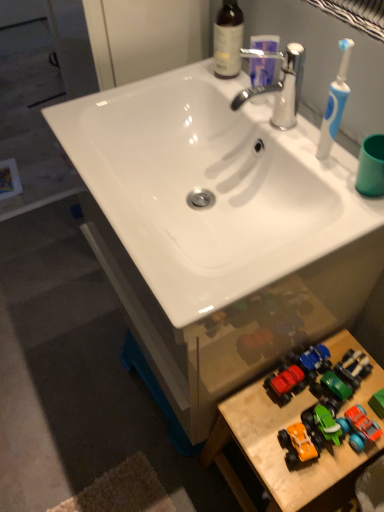
Question: Can you confirm if orange matte toy car at lower right is shorter than white glossy sink at center?

Choices:
 (A) yes
 (B) no

Answer: (A)

Question: Is orange matte toy car at lower right further to the viewer compared to white glossy sink at center?

Choices:
 (A) no
 (B) yes

Answer: (B)

Question: Considering the relative sizes of orange matte toy car at lower right and white glossy sink at center in the image provided, is orange matte toy car at lower right smaller than white glossy sink at center?

Choices:
 (A) no
 (B) yes

Answer: (B)

Question: Is orange matte toy car at lower right bigger than white glossy sink at center?

Choices:
 (A) yes
 (B) no

Answer: (B)

Question: From the image's perspective, would you say orange matte toy car at lower right is positioned over white glossy sink at center?

Choices:
 (A) yes
 (B) no

Answer: (B)

Question: Is white glossy sink at center located within orange matte toy car at lower right?

Choices:
 (A) no
 (B) yes

Answer: (A)

Question: Does white glossy sink at center have a lesser height compared to brown glass bottle at upper center?

Choices:
 (A) no
 (B) yes

Answer: (B)

Question: Is white glossy sink at center to the right of brown glass bottle at upper center from the viewer's perspective?

Choices:
 (A) yes
 (B) no

Answer: (B)

Question: From the image's perspective, is white glossy sink at center beneath brown glass bottle at upper center?

Choices:
 (A) yes
 (B) no

Answer: (A)

Question: From a real-world perspective, is white glossy sink at center physically below brown glass bottle at upper center?

Choices:
 (A) no
 (B) yes

Answer: (B)

Question: Is white glossy sink at center at the left side of brown glass bottle at upper center?

Choices:
 (A) yes
 (B) no

Answer: (A)

Question: Is white glossy sink at center not near brown glass bottle at upper center?

Choices:
 (A) yes
 (B) no

Answer: (B)

Question: Is chrome metallic faucet at upper center shorter than wooden toy cars at lower right?

Choices:
 (A) no
 (B) yes

Answer: (B)